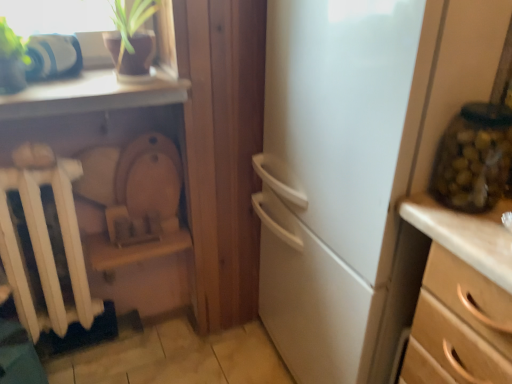
Question: From their relative heights in the image, would you say green glass jar at right is taller or shorter than white matte radiator at left?

Choices:
 (A) short
 (B) tall

Answer: (A)

Question: From the image's perspective, relative to white matte radiator at left, is green glass jar at right above or below?

Choices:
 (A) above
 (B) below

Answer: (A)

Question: Which is nearer to the green glass jar at right?

Choices:
 (A) wooden chest of drawers at right
 (B) white matte radiator at left

Answer: (A)

Question: Which object is the farthest from the white matte radiator at left?

Choices:
 (A) green glass jar at right
 (B) wooden chest of drawers at right

Answer: (A)